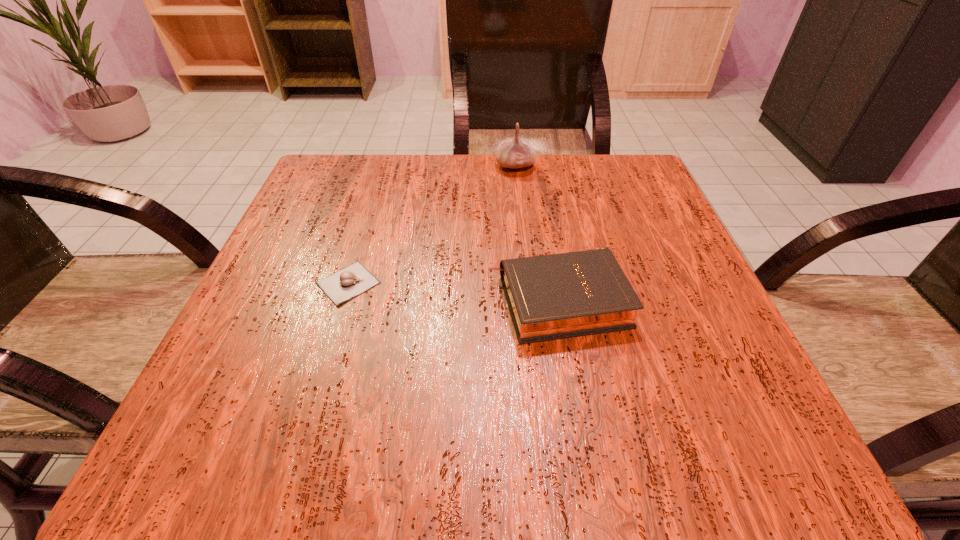
Locate which object is the closest to the Bible. Please provide its 2D coordinates. Your answer should be formatted as a tuple, i.e. [(x, y)], where the tuple contains the x and y coordinates of a point satisfying the conditions above.

[(349, 282)]

Locate an element on the screen. The image size is (960, 540). free space that satisfies the following two spatial constraints: 1. on the front side of the Bible; 2. on the right side of the left garlic is located at coordinates (343, 300).

Where is `free spot that satisfies the following two spatial constraints: 1. on the back side of the taller garlic; 2. on the left side of the left garlic`? free spot that satisfies the following two spatial constraints: 1. on the back side of the taller garlic; 2. on the left side of the left garlic is located at coordinates (384, 166).

You are a GUI agent. You are given a task and a screenshot of the screen. Output one action in this format:
    pyautogui.click(x=<x>, y=<y>)
    Task: Click on the free space that satisfies the following two spatial constraints: 1. on the front side of the second tallest object; 2. on the right side of the taller garlic
    Image resolution: width=960 pixels, height=540 pixels.
    Given the screenshot: What is the action you would take?
    pyautogui.click(x=531, y=300)

Find the location of a particular element. This screenshot has height=540, width=960. free location that satisfies the following two spatial constraints: 1. on the front side of the taller garlic; 2. on the left side of the second tallest object is located at coordinates (531, 300).